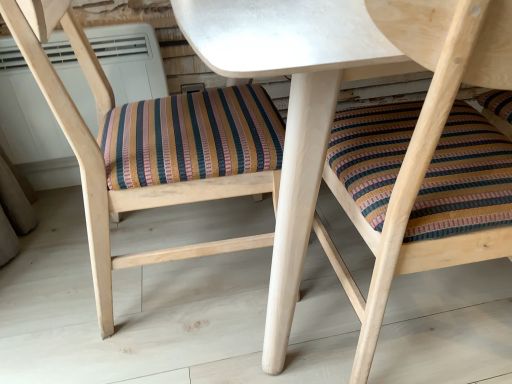
Describe the element at coordinates (128, 190) in the screenshot. The width and height of the screenshot is (512, 384). I see `multicolored woven cushion at center, the 2th chair from the right` at that location.

Where is `white plastic air conditioner at upper center`? white plastic air conditioner at upper center is located at coordinates (26, 112).

Considering the sizes of white matte table at center and wooden chair with striped cushion at center, the second chair when ordered from left to right, in the image, is white matte table at center wider or thinner than wooden chair with striped cushion at center, the second chair when ordered from left to right,?

white matte table at center is wider than wooden chair with striped cushion at center, the second chair when ordered from left to right.

Who is shorter, white matte table at center or wooden chair with striped cushion at center, marked as the first chair in a right-to-left arrangement?

With less height is white matte table at center.

How far apart are white matte table at center and wooden chair with striped cushion at center, the second chair when ordered from left to right?

white matte table at center is 9.06 centimeters away from wooden chair with striped cushion at center, the second chair when ordered from left to right.

Does white matte table at center come behind wooden chair with striped cushion at center, the second chair when ordered from left to right?

Yes, white matte table at center is further from the viewer.

Could you measure the distance between wooden chair with striped cushion at center, the second chair when ordered from left to right, and white plastic air conditioner at upper center?

The distance of wooden chair with striped cushion at center, the second chair when ordered from left to right, from white plastic air conditioner at upper center is 35.53 inches.

Does wooden chair with striped cushion at center, marked as the first chair in a right-to-left arrangement, have a lesser height compared to white plastic air conditioner at upper center?

No, wooden chair with striped cushion at center, marked as the first chair in a right-to-left arrangement, is not shorter than white plastic air conditioner at upper center.

In the scene shown: Is white plastic air conditioner at upper center inside wooden chair with striped cushion at center, marked as the first chair in a right-to-left arrangement?

Definitely not — white plastic air conditioner at upper center is not inside wooden chair with striped cushion at center, marked as the first chair in a right-to-left arrangement.

From a real-world perspective, is wooden chair with striped cushion at center, marked as the first chair in a right-to-left arrangement, positioned under white plastic air conditioner at upper center based on gravity?

No.

Identify the location of chair on the right of the white matte table at center. This screenshot has height=384, width=512. (434, 136).

How many degrees apart are the facing directions of wooden chair with striped cushion at center, marked as the first chair in a right-to-left arrangement, and white matte table at center?

The angular difference between wooden chair with striped cushion at center, marked as the first chair in a right-to-left arrangement, and white matte table at center is 178 degrees.

Is wooden chair with striped cushion at center, the second chair when ordered from left to right, completely or partially outside of white matte table at center?

That's incorrect, wooden chair with striped cushion at center, the second chair when ordered from left to right, is not completely outside white matte table at center.

Is point (423, 117) closer or farther from the camera than point (296, 89)?

Clearly, point (423, 117) is closer to the camera than point (296, 89).

Are multicolored woven cushion at center, the first chair viewed from the left, and white plastic air conditioner at upper center located far from each other?

No, there isn't a large distance between multicolored woven cushion at center, the first chair viewed from the left, and white plastic air conditioner at upper center.

Is white plastic air conditioner at upper center at the back of multicolored woven cushion at center, the 2th chair from the right?

No, multicolored woven cushion at center, the 2th chair from the right, is not facing the opposite direction of white plastic air conditioner at upper center.

From a real-world perspective, is multicolored woven cushion at center, the first chair viewed from the left, physically above white plastic air conditioner at upper center?

Correct, in the physical world, multicolored woven cushion at center, the first chair viewed from the left, is higher than white plastic air conditioner at upper center.

The height and width of the screenshot is (384, 512). Identify the location of the 1st chair to the right when counting from the white plastic air conditioner at upper center. (128, 190).

Relative to multicolored woven cushion at center, the first chair viewed from the left, is wooden chair with striped cushion at center, the second chair when ordered from left to right, in front or behind?

In the image, wooden chair with striped cushion at center, the second chair when ordered from left to right, appears in front of multicolored woven cushion at center, the first chair viewed from the left.

How many degrees apart are the facing directions of wooden chair with striped cushion at center, marked as the first chair in a right-to-left arrangement, and multicolored woven cushion at center, the first chair viewed from the left?

The facing directions of wooden chair with striped cushion at center, marked as the first chair in a right-to-left arrangement, and multicolored woven cushion at center, the first chair viewed from the left, are 94.4 degrees apart.

Considering the sizes of wooden chair with striped cushion at center, the second chair when ordered from left to right, and multicolored woven cushion at center, the 2th chair from the right, in the image, is wooden chair with striped cushion at center, the second chair when ordered from left to right, bigger or smaller than multicolored woven cushion at center, the 2th chair from the right,?

Considering their sizes, wooden chair with striped cushion at center, the second chair when ordered from left to right, takes up less space than multicolored woven cushion at center, the 2th chair from the right.

From the image's perspective, is wooden chair with striped cushion at center, the second chair when ordered from left to right, located beneath multicolored woven cushion at center, the first chair viewed from the left?

Yes, from the image's perspective, wooden chair with striped cushion at center, the second chair when ordered from left to right, is beneath multicolored woven cushion at center, the first chair viewed from the left.

Between white plastic air conditioner at upper center and multicolored woven cushion at center, the 2th chair from the right, which one is positioned in front?

multicolored woven cushion at center, the 2th chair from the right, is in front.

Visually, is white plastic air conditioner at upper center positioned to the left or to the right of multicolored woven cushion at center, the 2th chair from the right?

Clearly, white plastic air conditioner at upper center is on the left of multicolored woven cushion at center, the 2th chair from the right, in the image.

Is point (154, 87) farther from viewer compared to point (62, 102)?

Yes, it is behind point (62, 102).

The image size is (512, 384). Identify the location of chair that is the 1st object located below the white plastic air conditioner at upper center (from the image's perspective). (128, 190).

Can you confirm if multicolored woven cushion at center, the first chair viewed from the left, is bigger than white matte table at center?

Actually, multicolored woven cushion at center, the first chair viewed from the left, might be smaller than white matte table at center.

Is multicolored woven cushion at center, the first chair viewed from the left, oriented towards white matte table at center?

Yes, multicolored woven cushion at center, the first chair viewed from the left, is oriented towards white matte table at center.

Based on the photo, are multicolored woven cushion at center, the 2th chair from the right, and white matte table at center located far from each other?

No, there isn't a large distance between multicolored woven cushion at center, the 2th chair from the right, and white matte table at center.

In the image, is multicolored woven cushion at center, the 2th chair from the right, positioned in front of or behind white matte table at center?

In the image, multicolored woven cushion at center, the 2th chair from the right, appears behind white matte table at center.

Image resolution: width=512 pixels, height=384 pixels. Identify the location of table behind the wooden chair with striped cushion at center, the second chair when ordered from left to right. (292, 107).

From a real-world perspective, which chair is the 1st one above the white plastic air conditioner at upper center? Please provide its 2D coordinates.

[(434, 136)]

Based on their spatial positions, is white plastic air conditioner at upper center or wooden chair with striped cushion at center, the second chair when ordered from left to right, further from white matte table at center?

The object further to white matte table at center is white plastic air conditioner at upper center.

Considering their positions, is white plastic air conditioner at upper center positioned further to multicolored woven cushion at center, the first chair viewed from the left, than white matte table at center?

white plastic air conditioner at upper center lies further to multicolored woven cushion at center, the first chair viewed from the left, than the other object.

When comparing their distances from white plastic air conditioner at upper center, does wooden chair with striped cushion at center, marked as the first chair in a right-to-left arrangement, or white matte table at center seem closer?

white matte table at center is positioned closer to the anchor white plastic air conditioner at upper center.

From the picture: From the image, which object appears to be farther from wooden chair with striped cushion at center, marked as the first chair in a right-to-left arrangement, multicolored woven cushion at center, the first chair viewed from the left, or white matte table at center?

multicolored woven cushion at center, the first chair viewed from the left, lies further to wooden chair with striped cushion at center, marked as the first chair in a right-to-left arrangement, than the other object.

Consider the image. When comparing their distances from multicolored woven cushion at center, the 2th chair from the right, does wooden chair with striped cushion at center, the second chair when ordered from left to right, or white matte table at center seem closer?

white matte table at center is closer to multicolored woven cushion at center, the 2th chair from the right.

Based on their spatial positions, is white matte table at center or multicolored woven cushion at center, the first chair viewed from the left, closer to wooden chair with striped cushion at center, the second chair when ordered from left to right?

white matte table at center.

Based on their spatial positions, is white plastic air conditioner at upper center or multicolored woven cushion at center, the first chair viewed from the left, further from white matte table at center?

white plastic air conditioner at upper center is positioned further to the anchor white matte table at center.

In the scene shown: Based on their spatial positions, is white plastic air conditioner at upper center or white matte table at center closer to wooden chair with striped cushion at center, the second chair when ordered from left to right?

Based on the image, white matte table at center appears to be nearer to wooden chair with striped cushion at center, the second chair when ordered from left to right.

I want to click on chair situated between white plastic air conditioner at upper center and white matte table at center from left to right, so click(128, 190).

This screenshot has height=384, width=512. What are the coordinates of `table between white plastic air conditioner at upper center and wooden chair with striped cushion at center, marked as the first chair in a right-to-left arrangement` in the screenshot? It's located at (292, 107).

At what (x,y) coordinates should I click in order to perform the action: click on chair situated between white plastic air conditioner at upper center and wooden chair with striped cushion at center, marked as the first chair in a right-to-left arrangement, from left to right. Please return your answer as a coordinate pair (x, y). Looking at the image, I should click on (128, 190).

Locate an element on the screen. The height and width of the screenshot is (384, 512). table between multicolored woven cushion at center, the first chair viewed from the left, and wooden chair with striped cushion at center, marked as the first chair in a right-to-left arrangement, from left to right is located at coordinates (292, 107).